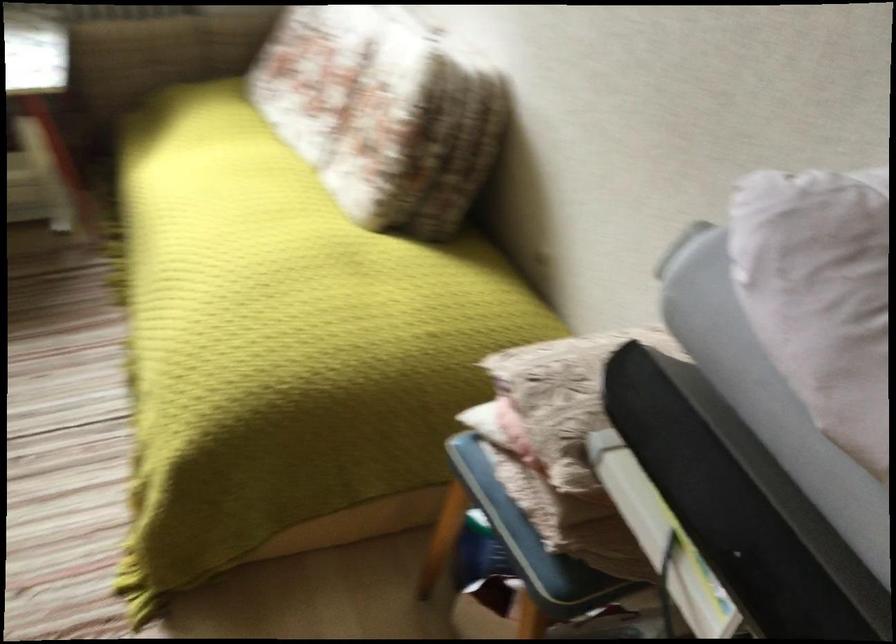
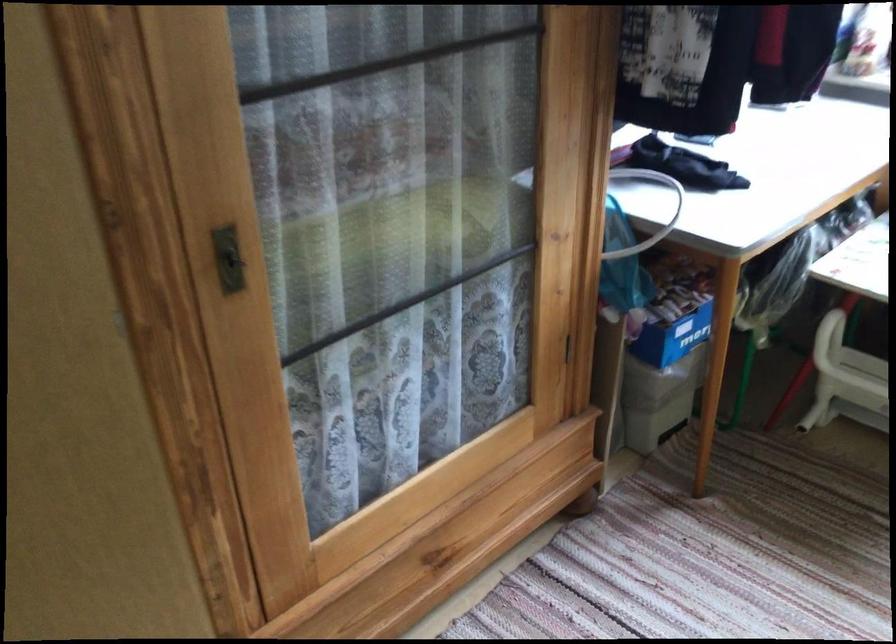
Question: How did the camera likely rotate?

Choices:
 (A) Left
 (B) Right
 (C) Up
 (D) Down

Answer: (A)